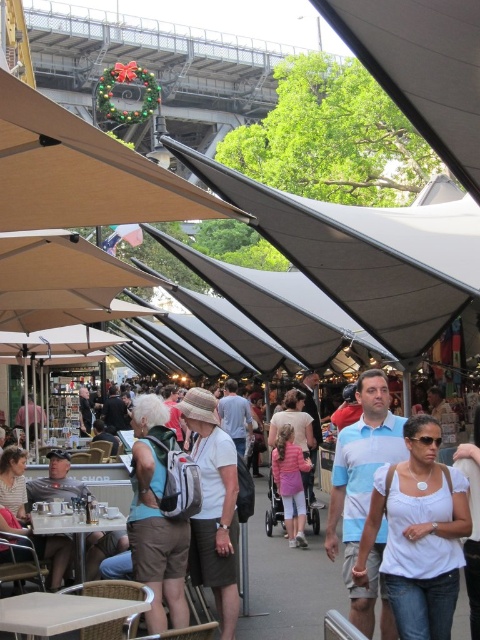
Question: Which of the following is the closest to the observer?

Choices:
 (A) (371, 602)
 (B) (456, 563)

Answer: (B)

Question: Does gray fabric canopy at center have a larger size compared to white matte shirt at center?

Choices:
 (A) yes
 (B) no

Answer: (A)

Question: Observing the image, what is the correct spatial positioning of gray fabric canopy at center in reference to green leafy canopy at upper center?

Choices:
 (A) above
 (B) below

Answer: (B)

Question: Does green leafy canopy at upper center lie behind blue striped polo shirt at center?

Choices:
 (A) yes
 (B) no

Answer: (B)

Question: Which of these objects is positioned closest to the white matte shirt at center?

Choices:
 (A) green leafy canopy at upper center
 (B) teal fabric backpack at center
 (C) gray fabric canopy at center
 (D) blue striped polo shirt at center

Answer: (D)

Question: Considering the real-world distances, which object is closest to the green leafy canopy at upper center?

Choices:
 (A) white matte shirt at center
 (B) teal fabric backpack at center
 (C) blue striped polo shirt at center
 (D) gray fabric canopy at center

Answer: (D)